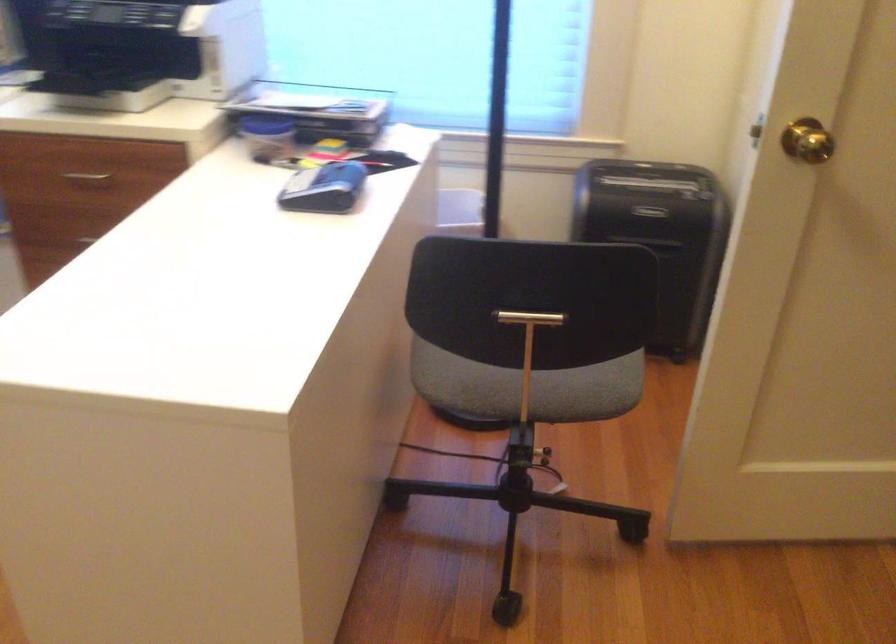
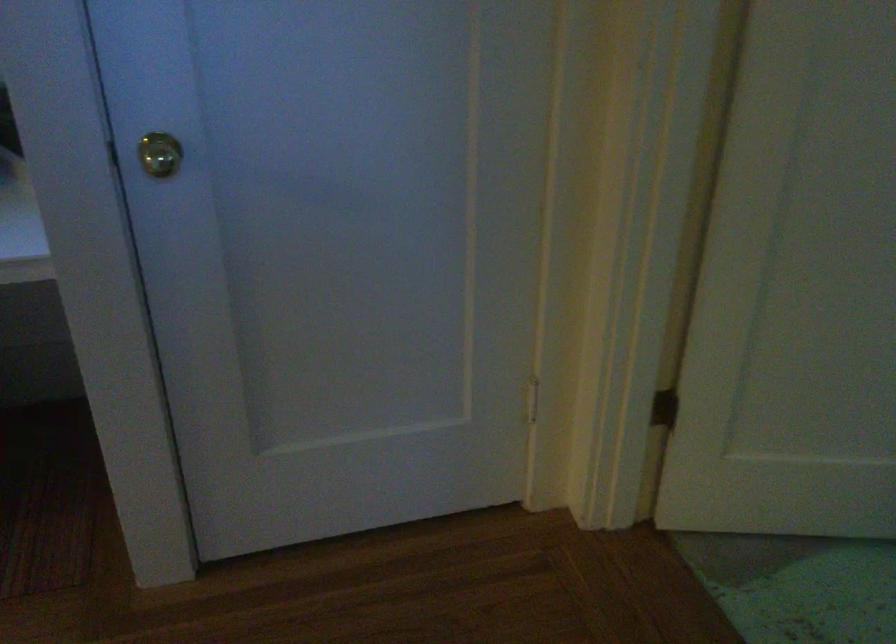
Question: Which direction would the cameraman need to move to produce the second image? Reply with the corresponding letter.

Choices:
 (A) Left
 (B) Right
 (C) Forward
 (D) Backward

Answer: (B)